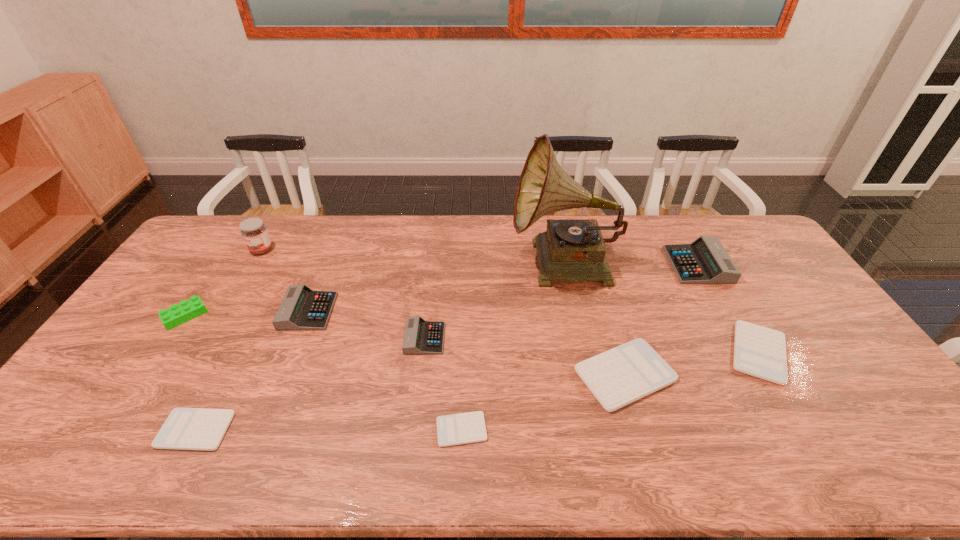
Where is `vacant space at the near right corner of the desktop`? Image resolution: width=960 pixels, height=540 pixels. vacant space at the near right corner of the desktop is located at coordinates (x=888, y=458).

Locate an element on the screen. The height and width of the screenshot is (540, 960). free space between the leftmost gray calculator and the third tallest calculator is located at coordinates (x=367, y=325).

Identify the location of unoccupied position between the second white calculator from left to right and the sixth calculator from right to left. This screenshot has width=960, height=540. (x=385, y=370).

Where is `vacant region between the smallest gray calculator and the seventh tallest object`? This screenshot has height=540, width=960. vacant region between the smallest gray calculator and the seventh tallest object is located at coordinates (525, 357).

I want to click on unoccupied area between the sixth tallest calculator and the record player, so click(x=380, y=348).

Find the location of a particular element. The width and height of the screenshot is (960, 540). vacant area that lies between the tallest object and the third white calculator from right to left is located at coordinates (513, 348).

The height and width of the screenshot is (540, 960). What are the coordinates of `free space between the sixth tallest calculator and the fifth shortest object` in the screenshot? It's located at (310, 384).

Locate an element on the screen. This screenshot has width=960, height=540. vacant space that is in between the record player and the ninth shortest object is located at coordinates (413, 258).

The width and height of the screenshot is (960, 540). I want to click on free spot between the biggest gray calculator and the third shortest calculator, so click(729, 309).

You are a GUI agent. You are given a task and a screenshot of the screen. Output one action in this format:
    pyautogui.click(x=<x>, y=<y>)
    Task: Click on the free spot between the record player and the farthest gray calculator
    This screenshot has height=540, width=960.
    Given the screenshot: What is the action you would take?
    pyautogui.click(x=631, y=265)